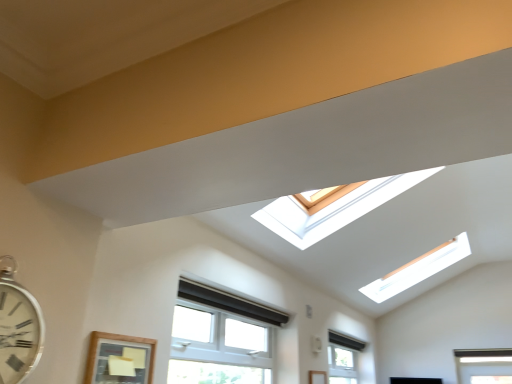
Question: Is wooden-framed window at lower left, which appears as the 3th window when viewed from the right, not within white metallic clock at left?

Choices:
 (A) no
 (B) yes

Answer: (B)

Question: From the image's perspective, does wooden-framed window at lower left, which ranks as the 1th window in front-to-back order, appear lower than white metallic clock at left?

Choices:
 (A) yes
 (B) no

Answer: (A)

Question: Does wooden-framed window at lower left, the third window when ordered from back to front, have a smaller size compared to white metallic clock at left?

Choices:
 (A) yes
 (B) no

Answer: (B)

Question: From a real-world perspective, is wooden-framed window at lower left, which appears as the 3th window when viewed from the right, positioned under white metallic clock at left based on gravity?

Choices:
 (A) yes
 (B) no

Answer: (A)

Question: Does wooden-framed window at lower left, the third window when ordered from back to front, have a lesser height compared to white metallic clock at left?

Choices:
 (A) no
 (B) yes

Answer: (A)

Question: Is point (105, 352) positioned closer to the camera than point (347, 342)?

Choices:
 (A) farther
 (B) closer

Answer: (B)

Question: From the image's perspective, is wooden-framed window at lower left, which ranks as the 1th window in front-to-back order, above or below clear glass window at lower center, the third window when ordered from left to right?

Choices:
 (A) below
 (B) above

Answer: (B)

Question: From their relative heights in the image, would you say wooden-framed window at lower left, the third window when ordered from back to front, is taller or shorter than clear glass window at lower center, which is counted as the first window, starting from the back?

Choices:
 (A) short
 (B) tall

Answer: (B)

Question: Is wooden-framed window at lower left, which ranks as the 1th window in front-to-back order, spatially inside clear glass window at lower center, the third window when ordered from left to right, or outside of it?

Choices:
 (A) outside
 (B) inside

Answer: (A)

Question: Does point (23, 309) appear closer or farther from the camera than point (131, 344)?

Choices:
 (A) farther
 (B) closer

Answer: (B)

Question: Is white metallic clock at left inside or outside of wooden-framed window at lower left, which appears as the 3th window when viewed from the right?

Choices:
 (A) inside
 (B) outside

Answer: (B)

Question: From a real-world perspective, relative to wooden-framed window at lower left, which ranks as the 1th window in front-to-back order, is white metallic clock at left vertically above or below?

Choices:
 (A) below
 (B) above

Answer: (B)

Question: Considering their positions, is white metallic clock at left located in front of or behind wooden-framed window at lower left, which ranks as the 1th window in front-to-back order?

Choices:
 (A) behind
 (B) front

Answer: (B)

Question: Do you think white plastic window at lower center, placed as the second window when sorted from left to right, is within white metallic clock at left, or outside of it?

Choices:
 (A) outside
 (B) inside

Answer: (A)

Question: From their relative heights in the image, would you say white plastic window at lower center, placed as the second window when sorted from left to right, is taller or shorter than white metallic clock at left?

Choices:
 (A) tall
 (B) short

Answer: (A)